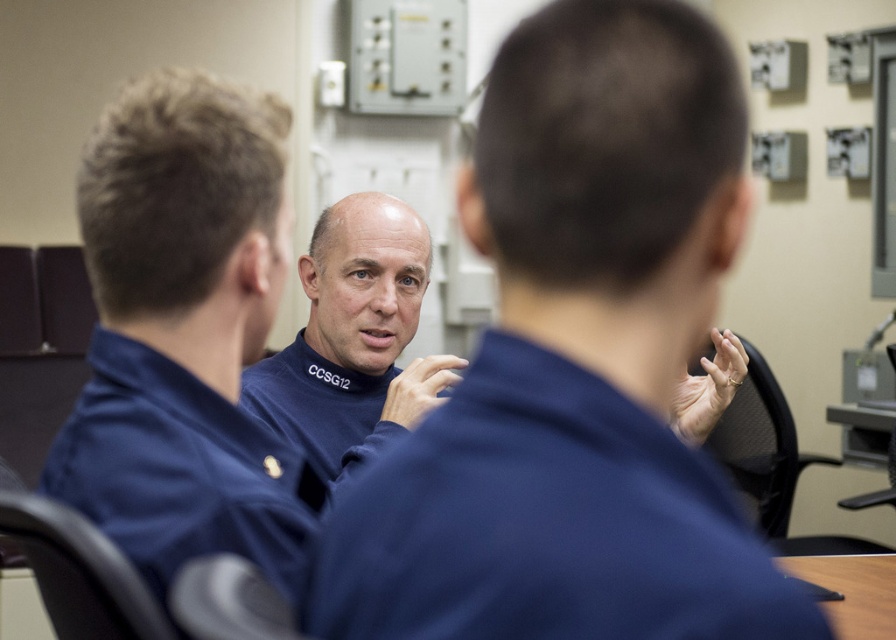
Is navy blue sweater at center below blue fabric shirt at center?

Yes, navy blue sweater at center is below blue fabric shirt at center.

Is navy blue sweater at center to the right of blue fabric shirt at center from the viewer's perspective?

Indeed, navy blue sweater at center is positioned on the right side of blue fabric shirt at center.

Locate an element on the screen. The width and height of the screenshot is (896, 640). navy blue sweater at center is located at coordinates (545, 524).

Where is `navy blue sweater at center`? The width and height of the screenshot is (896, 640). navy blue sweater at center is located at coordinates (545, 524).

Which of these two, navy blue uniform at center or blue fabric shirt at center, stands taller?

Standing taller between the two is blue fabric shirt at center.

Is point (712, 509) less distant than point (194, 378)?

That is True.

Find the location of a particular element. The width and height of the screenshot is (896, 640). navy blue uniform at center is located at coordinates (576, 365).

Who is higher up, navy blue sweater at center or gray fabric chair at lower left?

navy blue sweater at center

I want to click on navy blue sweater at center, so click(x=545, y=524).

Where is `navy blue sweater at center`? The image size is (896, 640). navy blue sweater at center is located at coordinates (545, 524).